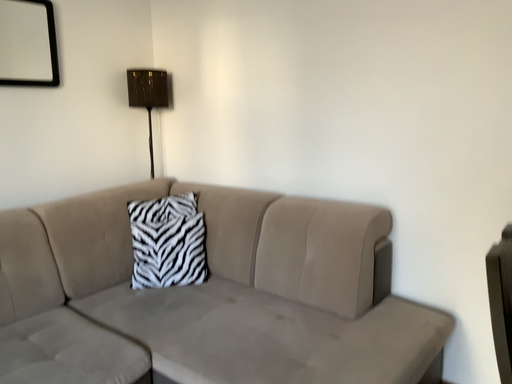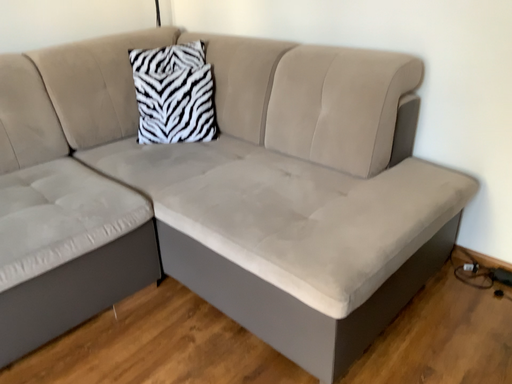
Question: Which way did the camera rotate in the video?

Choices:
 (A) rotated upward
 (B) rotated downward

Answer: (B)